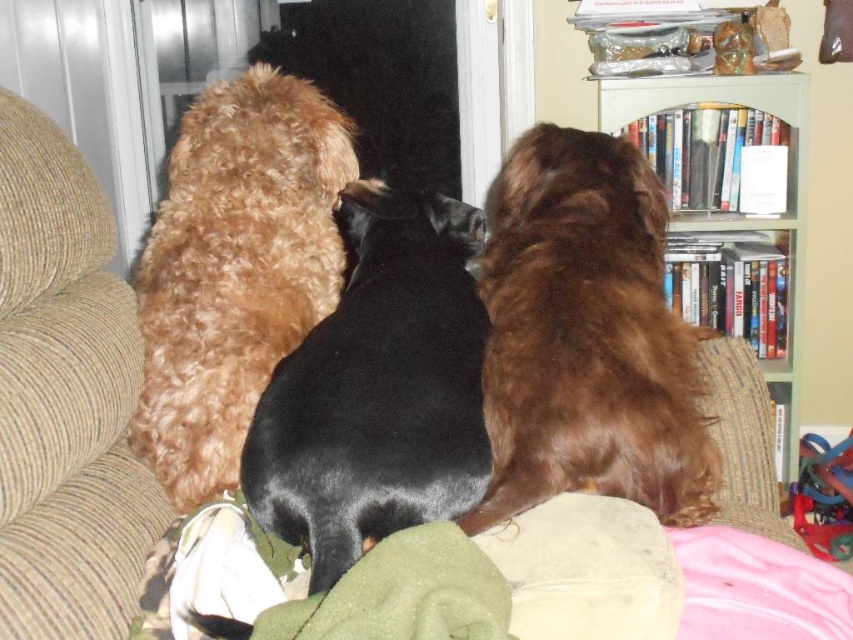
You are a delivery robot approaching the couch where the three dogs are sitting. You need to place a package at point (187, 307) and point (795, 307). Which point should you deliver to first if you want to reach the closer one first?

You should deliver to point (187, 307) first because it is in front of point (795, 307), meaning it is closer to you.